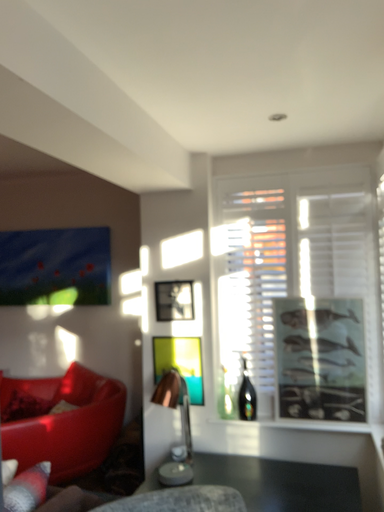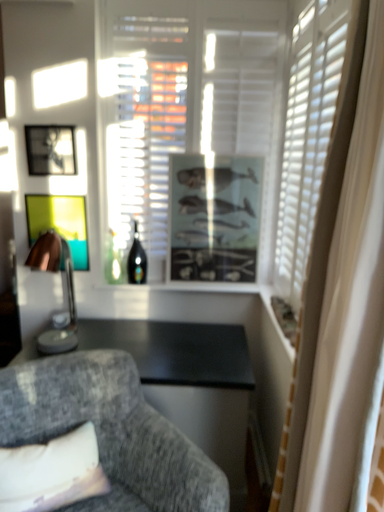
Question: Which way did the camera rotate in the video?

Choices:
 (A) rotated upward
 (B) rotated downward

Answer: (B)